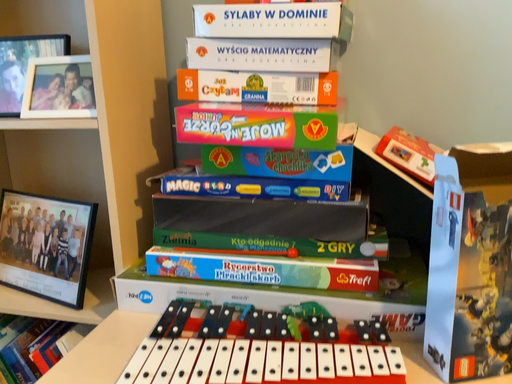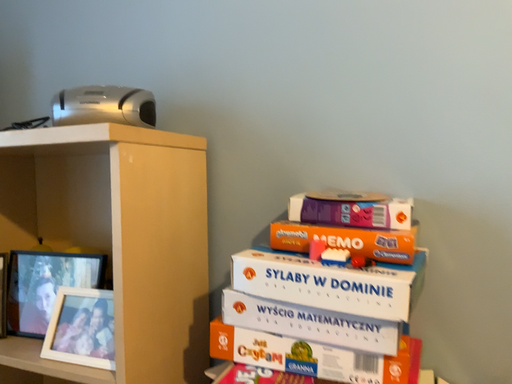
Question: Which way did the camera rotate in the video?

Choices:
 (A) rotated downward
 (B) rotated upward

Answer: (B)